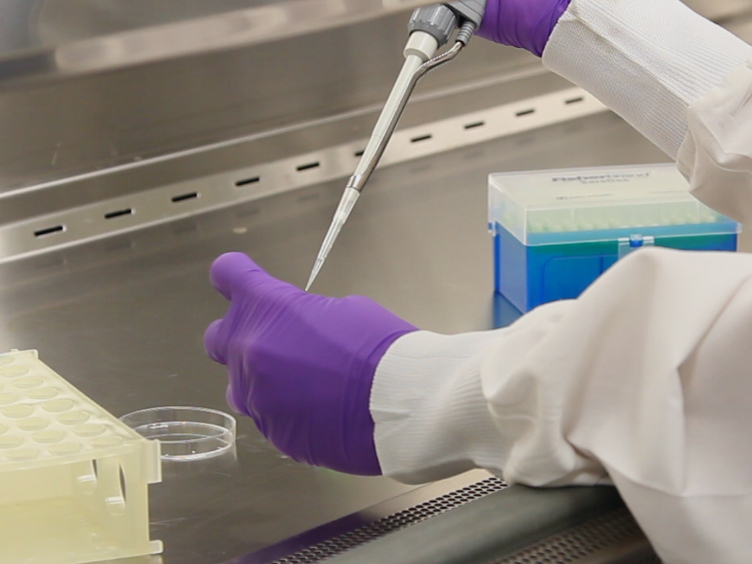
Identify the location of drain. (390, 517), (556, 547).